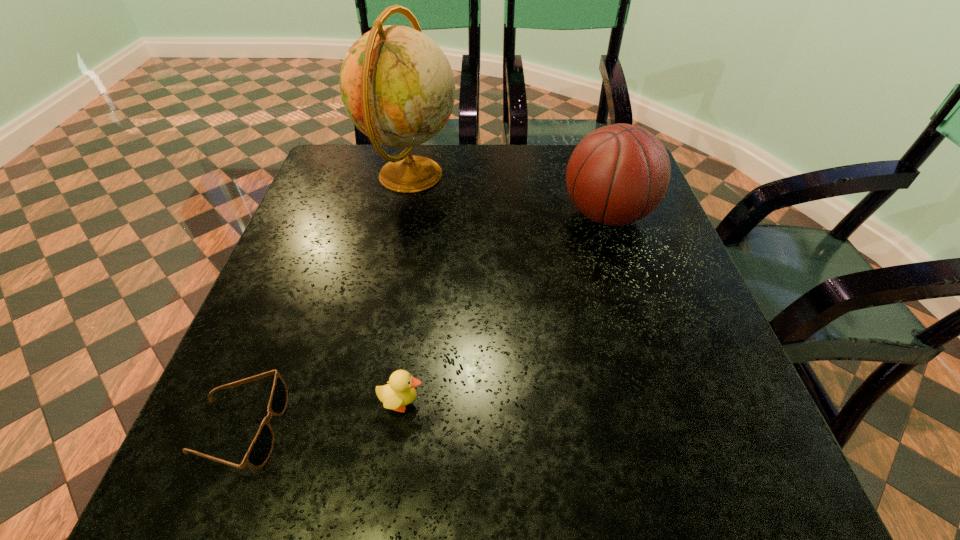
Identify the location of basketball present at the far edge. Image resolution: width=960 pixels, height=540 pixels. (618, 174).

Locate an element on the screen. The height and width of the screenshot is (540, 960). object present at the near edge is located at coordinates (261, 448).

This screenshot has width=960, height=540. Find the location of `globe that is at the left edge`. globe that is at the left edge is located at coordinates (397, 86).

This screenshot has height=540, width=960. I want to click on sunglasses that is at the left edge, so click(261, 448).

Where is `object located at the right edge`? Image resolution: width=960 pixels, height=540 pixels. object located at the right edge is located at coordinates 618,174.

Identify the location of object that is positioned at the far left corner. (397, 86).

Where is `object situated at the near left corner`? object situated at the near left corner is located at coordinates (261, 448).

Locate an element on the screen. The image size is (960, 540). object located in the far right corner section of the desktop is located at coordinates (618, 174).

Find the location of a particular element. vacant space at the far edge of the desktop is located at coordinates (468, 180).

The width and height of the screenshot is (960, 540). I want to click on free space at the near edge, so click(x=657, y=463).